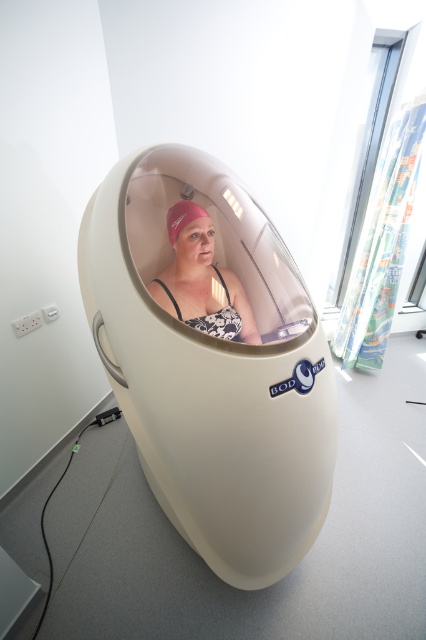
You are a technician standing 36 inches away from the viewer. You need to reach the white matte capsule at center to adjust its settings. Can you comfortably reach it without moving closer?

The white matte capsule at center and viewer are 38.09 inches apart. Since you are 36 inches away from the viewer, you are 2.09 inches closer than the required distance, so you can comfortably reach the white matte capsule at center without needing to move closer.

You are standing in the room with the BOD POD and need to place a small sensor between the two points labeled point (244, 588) and point (226, 316). Which point should the sensor be closer to in order to be positioned in front of the other?

The sensor should be closer to point (244, 588) because it is in front of point (226, 316).